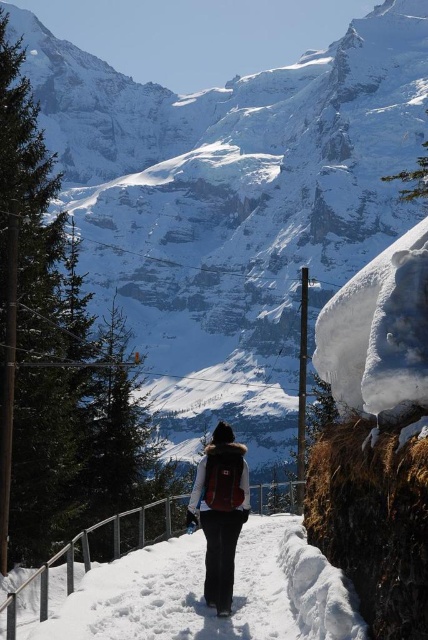
Does point (315, 579) lie in front of point (222, 486)?

Yes, it is in front of point (222, 486).

Does black fabric pants at center come behind matte brown backpack at center?

No.

Between point (302, 547) and point (225, 509), which one is positioned in front?

Point (302, 547) is more forward.

I want to click on black fabric pants at center, so click(x=202, y=593).